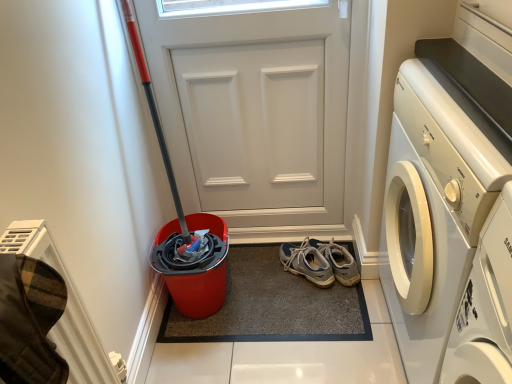
Find the location of a particular element. The width and height of the screenshot is (512, 384). free location in front of light blue suede sneakers at center is located at coordinates (313, 307).